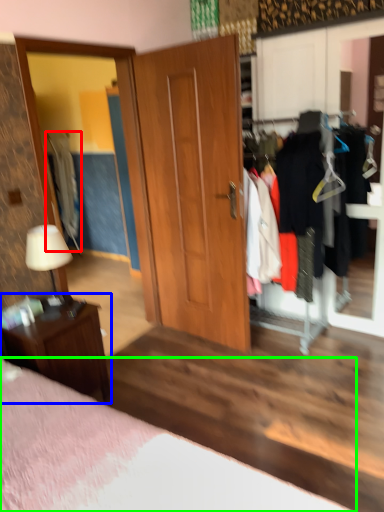
Question: Estimate the real-world distances between objects in this image. Which object is closer to clothing (highlighted by a red box), nightstand (highlighted by a blue box) or bed (highlighted by a green box)?

Choices:
 (A) nightstand
 (B) bed

Answer: (A)